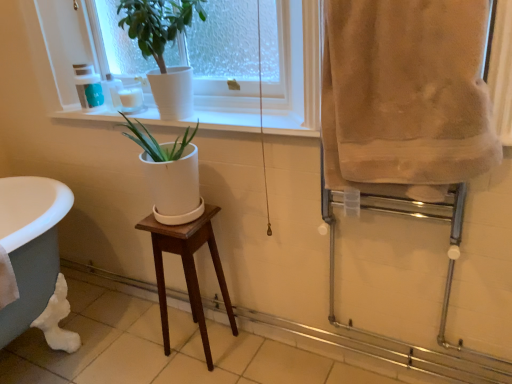
This screenshot has width=512, height=384. I want to click on vacant area that lies to the right of mahogany wood stool at center, so click(x=250, y=362).